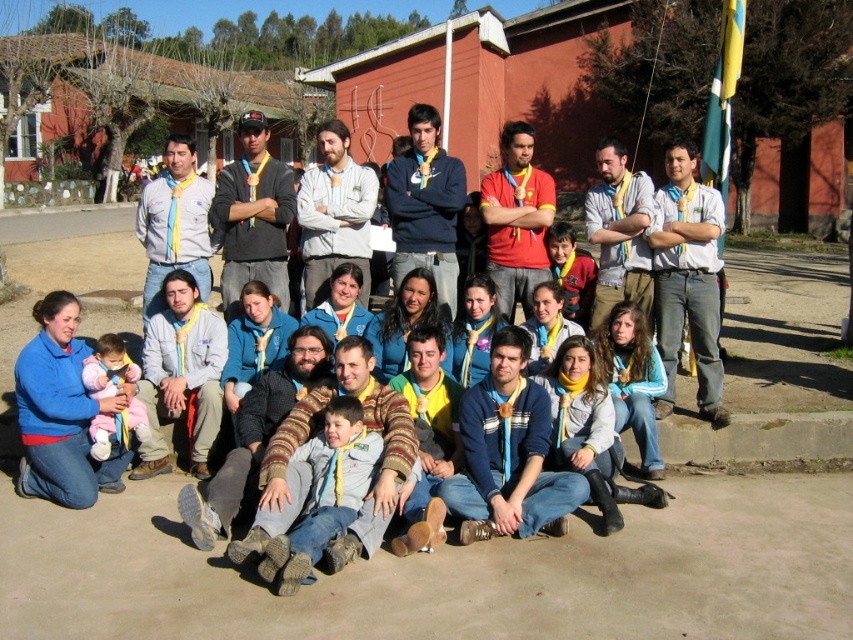
Question: Is white fleece jacket at center wider than matte yellow necktie at center?

Choices:
 (A) yes
 (B) no

Answer: (B)

Question: Which object appears closest to the camera in this image?

Choices:
 (A) soft pink fabric baby at lower left
 (B) knitted sweater at center
 (C) white fleece jacket at center

Answer: (B)

Question: Does matte blue sweater at center lie in front of matte white shirt at center?

Choices:
 (A) no
 (B) yes

Answer: (B)

Question: Which point is farther to the camera?

Choices:
 (A) (538, 484)
 (B) (189, 138)

Answer: (B)

Question: Is matte black jacket at center thinner than matte yellow necktie at center?

Choices:
 (A) yes
 (B) no

Answer: (B)

Question: Which object is closer to the camera taking this photo?

Choices:
 (A) blue fleece jacket at center
 (B) matte gray jacket at lower left
 (C) soft pink fabric baby at lower left

Answer: (A)